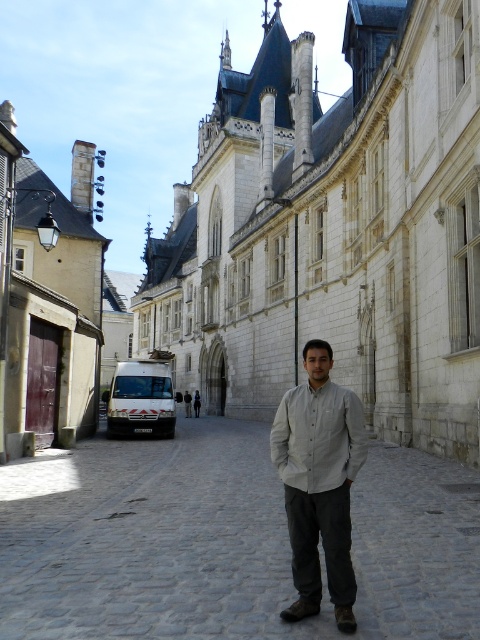
Does gray cobblestone alley at center come behind matte red door at left?

No, it is in front of matte red door at left.

Does point (144, 480) come closer to viewer compared to point (60, 422)?

Yes.

Find the location of `gray cobblestone alley at center`. gray cobblestone alley at center is located at coordinates (225, 541).

Is gray cobblestone alley at center in front of light gray shirt at center?

That is True.

Consider the image. Does gray cobblestone alley at center have a lesser width compared to light gray shirt at center?

Incorrect, gray cobblestone alley at center's width is not less than light gray shirt at center's.

The image size is (480, 640). I want to click on gray cobblestone alley at center, so click(x=225, y=541).

Who is more distant from viewer, [28,355] or [322,445]?

Point [28,355]

Can you confirm if matte red door at left is wider than light gray shirt at center?

Yes, matte red door at left is wider than light gray shirt at center.

Is point (40, 397) in front of point (292, 484)?

No, it is behind (292, 484).

You are a GUI agent. You are given a task and a screenshot of the screen. Output one action in this format:
    pyautogui.click(x=<x>, y=<y>)
    Task: Click on the matte red door at left
    Image resolution: width=480 pixels, height=640 pixels.
    Given the screenshot: What is the action you would take?
    pyautogui.click(x=47, y=301)